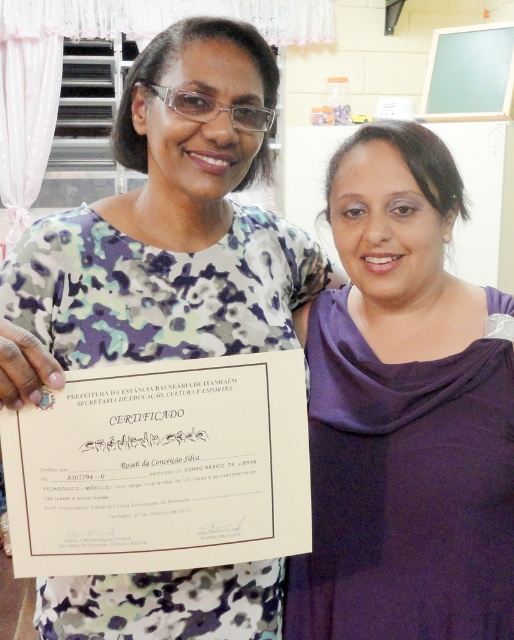
Question: In this image, where is purple matte dress at center located relative to white paper certificate at center?

Choices:
 (A) below
 (B) above

Answer: (B)

Question: From the image, what is the correct spatial relationship of purple matte dress at center in relation to camouflage fabric shirt at center?

Choices:
 (A) above
 (B) below

Answer: (B)

Question: Which point is closer to the camera?

Choices:
 (A) (261, 476)
 (B) (121, 330)

Answer: (A)

Question: Which object is the farthest from the purple matte dress at center?

Choices:
 (A) white paper certificate at center
 (B) camouflage fabric shirt at center

Answer: (B)

Question: Is purple matte dress at center further to camera compared to white paper certificate at center?

Choices:
 (A) yes
 (B) no

Answer: (A)

Question: Which point is closer to the camera taking this photo?

Choices:
 (A) (6, 465)
 (B) (172, 147)

Answer: (A)